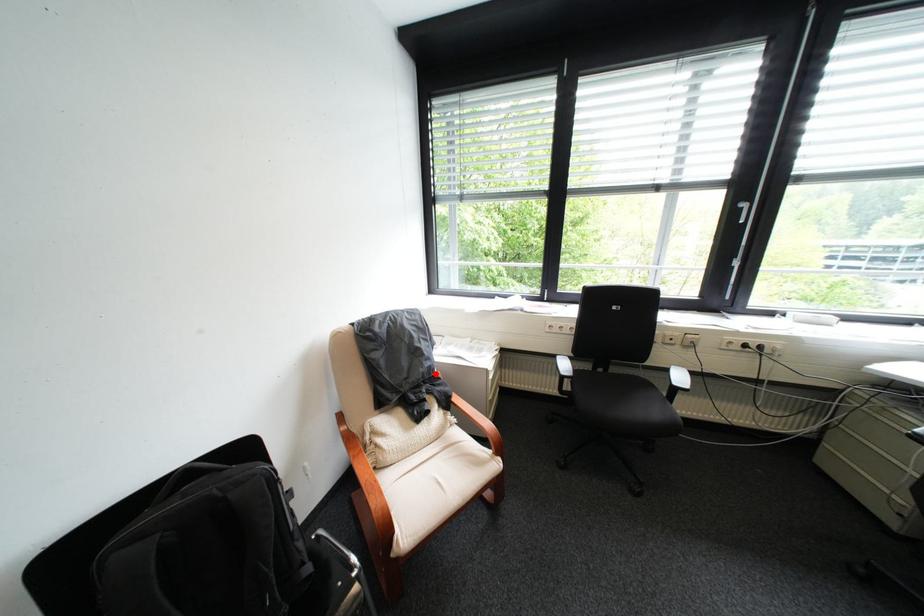
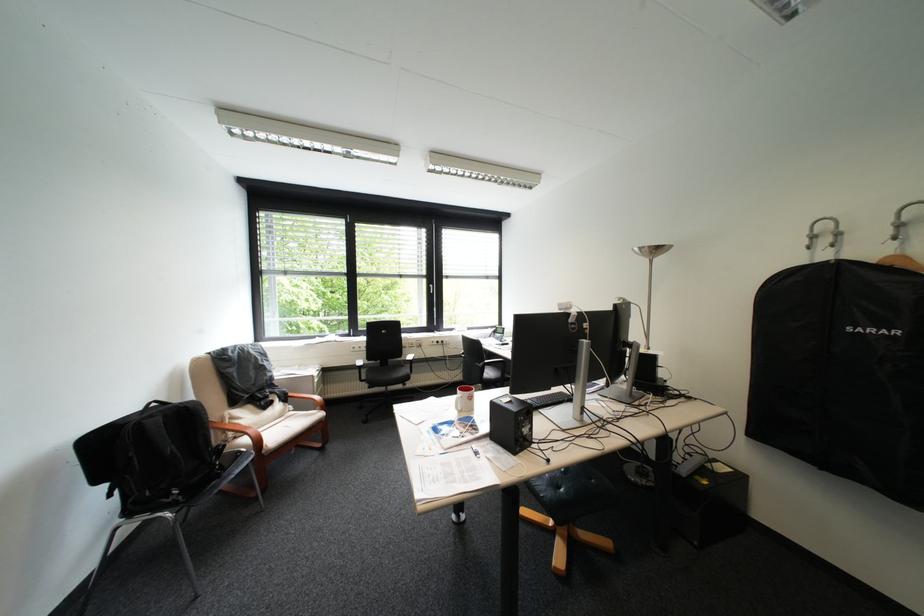
The point at the highlighted location is marked in the first image. Where is the corresponding point in the second image?

(280, 381)